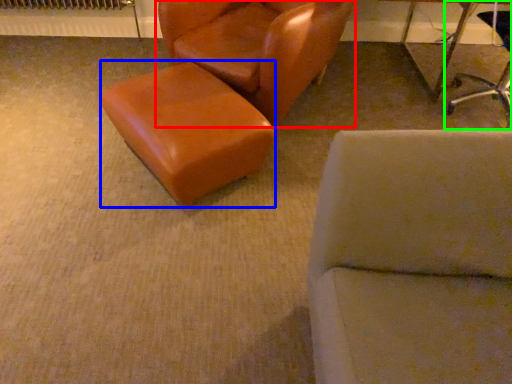
Question: Which object is the farthest from chair (highlighted by a red box)? Choose among these: stool (highlighted by a blue box) or chair (highlighted by a green box).

Choices:
 (A) stool
 (B) chair

Answer: (B)